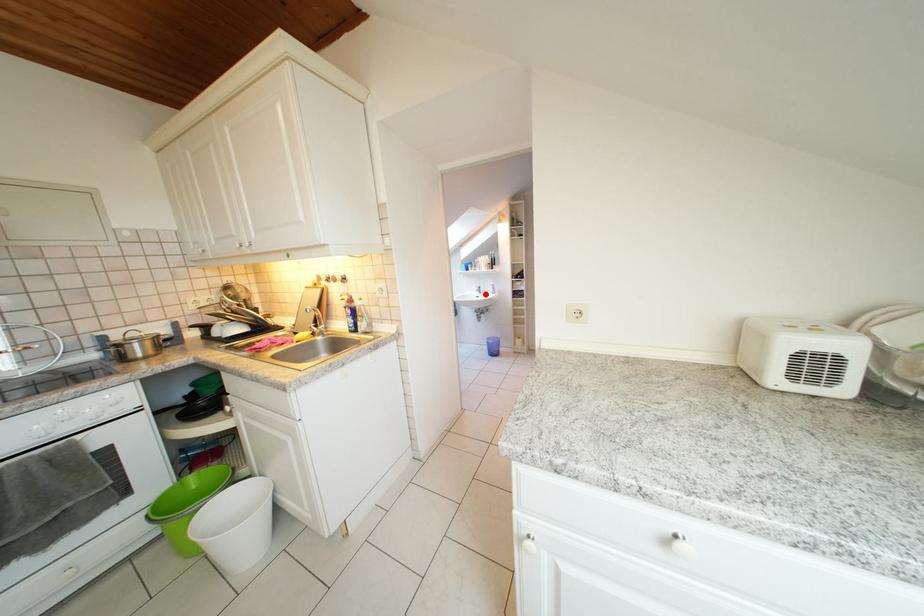
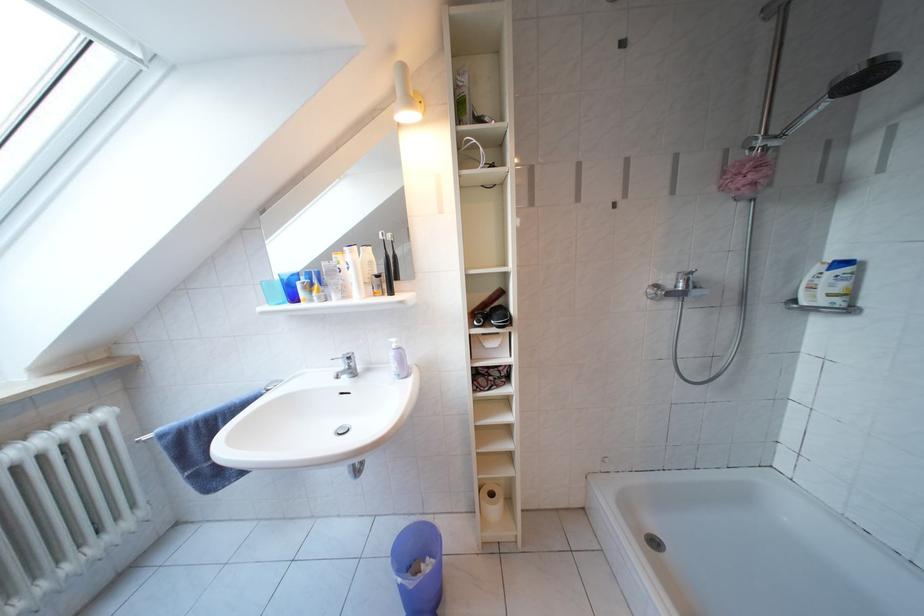
Where in the second image is the point corresponding to the highlighted location from the first image?

(349, 371)